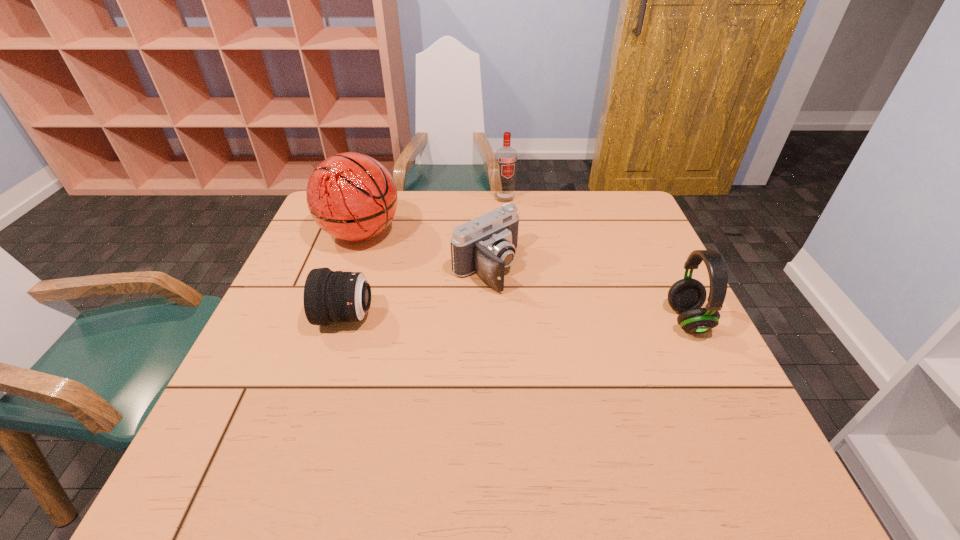
I want to click on telephoto lens that is at the left edge, so click(329, 296).

At what (x,y) coordinates should I click in order to perform the action: click on basketball that is at the left edge. Please return your answer as a coordinate pair (x, y). Image resolution: width=960 pixels, height=540 pixels. Looking at the image, I should click on [x=351, y=196].

Locate an element on the screen. The width and height of the screenshot is (960, 540). object located at the right edge is located at coordinates (686, 296).

At what (x,y) coordinates should I click in order to perform the action: click on object that is at the far left corner. Please return your answer as a coordinate pair (x, y). This screenshot has width=960, height=540. Looking at the image, I should click on (351, 196).

Locate an element on the screen. The width and height of the screenshot is (960, 540). blank space at the far edge is located at coordinates (564, 199).

In the image, there is a desktop. Identify the location of vacant space at the near edge. The height and width of the screenshot is (540, 960). (553, 426).

In the image, there is a desktop. Identify the location of free space at the left edge. (279, 318).

Image resolution: width=960 pixels, height=540 pixels. In the image, there is a desktop. Find the location of `vacant region at the right edge`. vacant region at the right edge is located at coordinates (614, 277).

I want to click on vacant area at the near left corner of the desktop, so click(x=252, y=404).

The height and width of the screenshot is (540, 960). In the image, there is a desktop. In order to click on free space at the far right corner in this screenshot , I will do `click(623, 213)`.